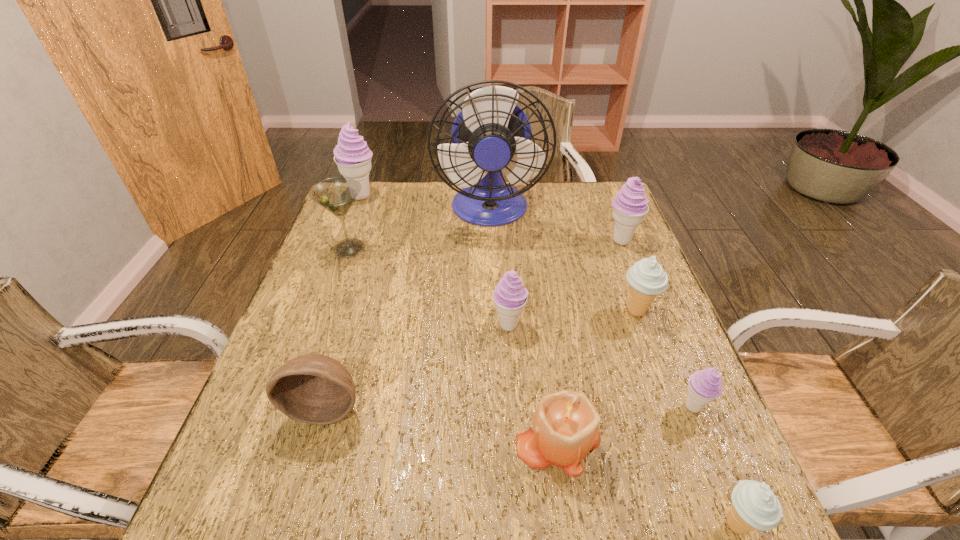
Locate an element on the screen. The image size is (960, 540). beige candle is located at coordinates (565, 427).

I want to click on the nearest purple icecream, so click(704, 386).

This screenshot has width=960, height=540. Identify the location of the fifth farthest icecream. (704, 386).

Where is `free space located in front of the tallest object where the airflow is directed`? The width and height of the screenshot is (960, 540). free space located in front of the tallest object where the airflow is directed is located at coordinates (491, 256).

The height and width of the screenshot is (540, 960). What are the coordinates of `free space located 0.320m on the front of the farthest purple icecream` in the screenshot? It's located at (334, 270).

Where is `free space located on the right of the martini`? Image resolution: width=960 pixels, height=540 pixels. free space located on the right of the martini is located at coordinates (418, 248).

The image size is (960, 540). I want to click on free point located 0.200m on the left of the second biggest purple icecream, so click(536, 240).

This screenshot has width=960, height=540. Find the location of `blank space located 0.390m on the front of the farther beige icecream`. blank space located 0.390m on the front of the farther beige icecream is located at coordinates tap(703, 495).

Find the location of `free location located 0.090m on the right of the second purple icecream from left to right`. free location located 0.090m on the right of the second purple icecream from left to right is located at coordinates (564, 325).

The image size is (960, 540). Find the location of `vacant space located on the back of the bowl`. vacant space located on the back of the bowl is located at coordinates (368, 265).